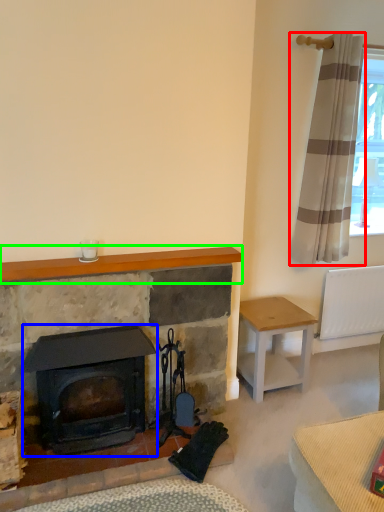
Question: Which object is positioned farthest from curtain (highlighted by a red box)? Select from wood burning stove (highlighted by a blue box) and mantle (highlighted by a green box).

Choices:
 (A) wood burning stove
 (B) mantle

Answer: (A)